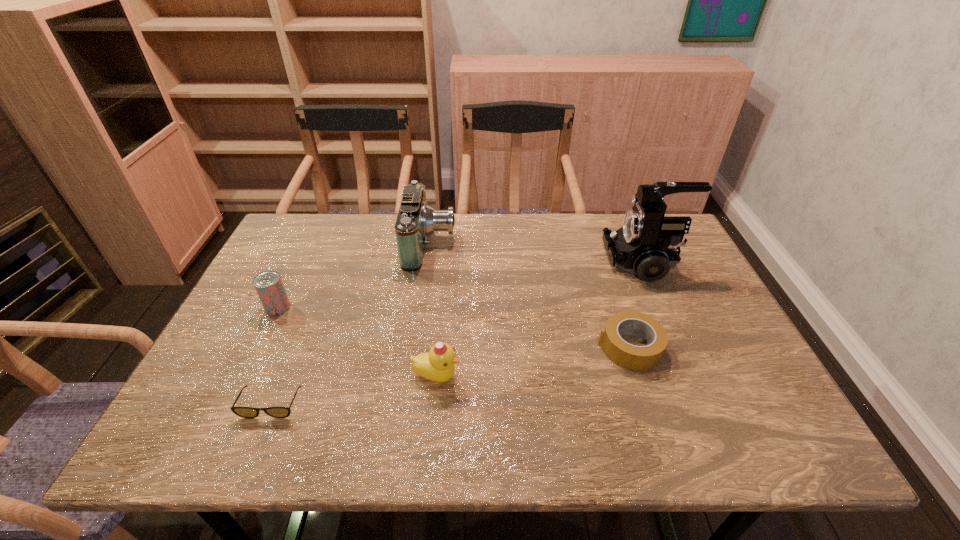
Image resolution: width=960 pixels, height=540 pixels. Find the location of `the tallest object`. the tallest object is located at coordinates (646, 244).

Identify the location of the right camcorder. (646, 244).

Image resolution: width=960 pixels, height=540 pixels. What are the coordinates of `the fifth shortest object` in the screenshot? It's located at (416, 220).

You are a GUI agent. You are given a task and a screenshot of the screen. Output one action in this format:
    pyautogui.click(x=<x>, y=<y>)
    Task: Click on the shorter camcorder
    This screenshot has height=540, width=960.
    Given the screenshot: What is the action you would take?
    pyautogui.click(x=416, y=220)

I want to click on the fourth shortest object, so click(x=438, y=365).

You are a GUI agent. You are given a task and a screenshot of the screen. Output one action in this format:
    pyautogui.click(x=<x>, y=<y>)
    Task: Click on the third shortest object
    
    Given the screenshot: What is the action you would take?
    pyautogui.click(x=268, y=284)

At what (x,y) coordinates should I click in order to perform the action: click on beer can. Please return your answer as a coordinate pair (x, y). This screenshot has height=540, width=960. Looking at the image, I should click on (268, 284).

This screenshot has height=540, width=960. In order to click on duct tape in this screenshot , I will do `click(638, 358)`.

In order to click on sunglasses in this screenshot , I will do `click(245, 412)`.

The height and width of the screenshot is (540, 960). I want to click on the shortest object, so click(x=245, y=412).